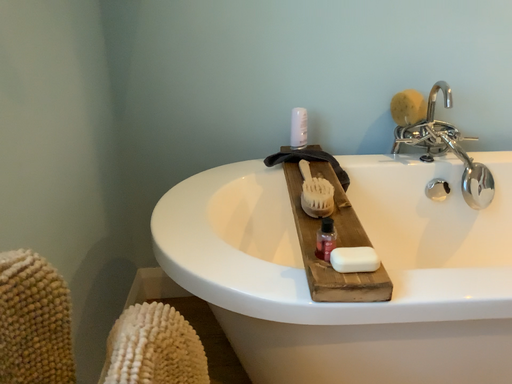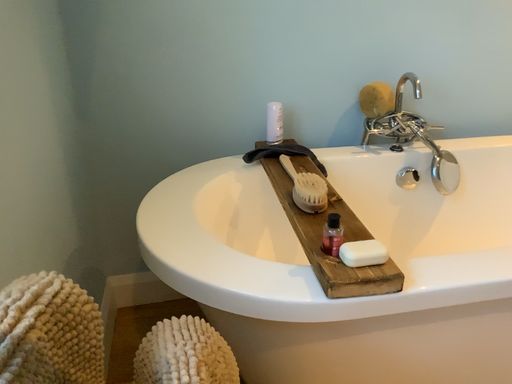
Question: Which way did the camera rotate in the video?

Choices:
 (A) rotated right
 (B) rotated left

Answer: (A)